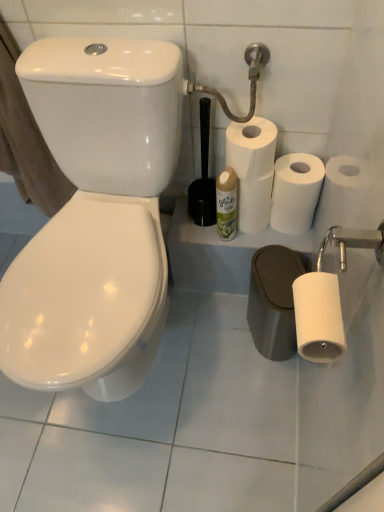
Question: Is white matte paper towel at center not inside white matte toilet paper at upper right, arranged as the third toilet paper when viewed from the front?

Choices:
 (A) no
 (B) yes

Answer: (B)

Question: From a real-world perspective, is white matte paper towel at center located higher than white matte toilet paper at upper right, which is counted as the 2th toilet paper, starting from the bottom?

Choices:
 (A) yes
 (B) no

Answer: (B)

Question: Is white matte paper towel at center at the right side of white matte toilet paper at upper right, placed as the 1th toilet paper when sorted from back to front?

Choices:
 (A) no
 (B) yes

Answer: (A)

Question: Is white matte paper towel at center not near white matte toilet paper at upper right, placed as the 1th toilet paper when sorted from back to front?

Choices:
 (A) no
 (B) yes

Answer: (A)

Question: Is white matte paper towel at center at the left side of white matte toilet paper at upper right, placed as the 1th toilet paper when sorted from back to front?

Choices:
 (A) yes
 (B) no

Answer: (A)

Question: Does white matte paper towel at center have a lesser height compared to white matte toilet paper at upper right, placed as the 1th toilet paper when sorted from back to front?

Choices:
 (A) no
 (B) yes

Answer: (B)

Question: Is white matte toilet paper at upper right, placed as the 1th toilet paper when sorted from back to front, with brown cotton bath towel at left?

Choices:
 (A) yes
 (B) no

Answer: (B)

Question: Does white matte toilet paper at upper right, placed as the 1th toilet paper when sorted from back to front, have a larger size compared to brown cotton bath towel at left?

Choices:
 (A) yes
 (B) no

Answer: (B)

Question: Is brown cotton bath towel at left surrounded by white matte toilet paper at upper right, arranged as the third toilet paper when viewed from the front?

Choices:
 (A) yes
 (B) no

Answer: (B)

Question: Considering the relative sizes of white matte toilet paper at upper right, placed as the 1th toilet paper when sorted from back to front, and brown cotton bath towel at left in the image provided, is white matte toilet paper at upper right, placed as the 1th toilet paper when sorted from back to front, shorter than brown cotton bath towel at left?

Choices:
 (A) no
 (B) yes

Answer: (B)

Question: From a real-world perspective, is white matte toilet paper at upper right, the second toilet paper when ordered from top to bottom, positioned under brown cotton bath towel at left based on gravity?

Choices:
 (A) no
 (B) yes

Answer: (B)

Question: Is white matte toilet paper at upper right, which is counted as the 2th toilet paper, starting from the bottom, positioned far away from brown cotton bath towel at left?

Choices:
 (A) yes
 (B) no

Answer: (B)

Question: Could you tell me if white matte toilet paper at upper right, arranged as the third toilet paper when viewed from the front, is facing metallic silver shower head at upper right?

Choices:
 (A) yes
 (B) no

Answer: (B)